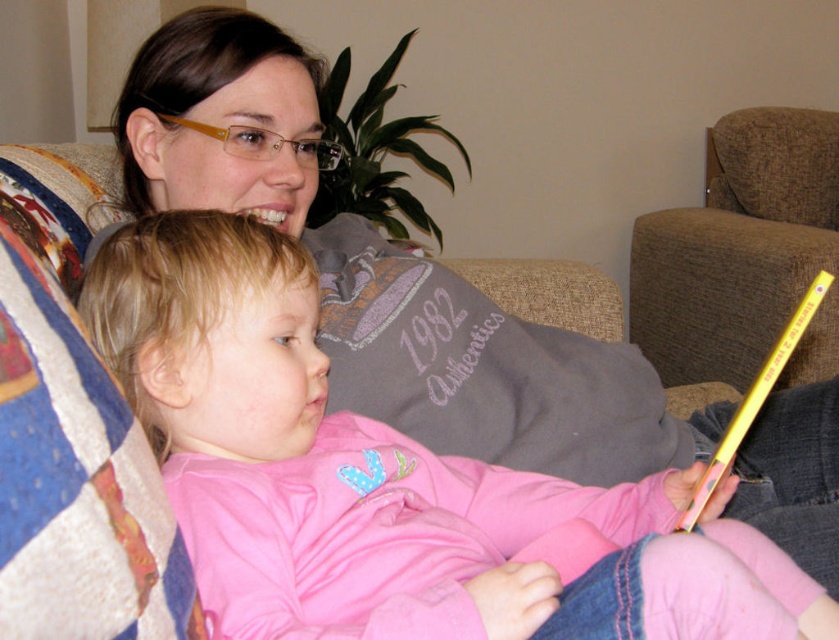
You are designing a layout for a small living room and need to place both the pink fleece sweater at center and the brown fabric armchair at upper right. Given their sizes, which object requires more space in the room?

The brown fabric armchair at upper right requires more space because the pink fleece sweater at center occupies less space than it.

You are a delivery person who needs to place a small package between the pink fleece sweater at center and the brown fabric armchair at upper right. The package is 1 foot in length. Can you fit the package in the space between them?

The pink fleece sweater at center is 5.24 feet away from the brown fabric armchair at upper right. Since the package is only 1 foot long, there is enough space to place it between them.

You are a delivery person standing 20 inches away from the couch. You need to place a small package on the pink fleece sweater at center without disturbing the people sitting there. Is the distance sufficient to do so?

The pink fleece sweater at center is 19.25 inches from the viewer. Since you are standing 20 inches away, you can reach it comfortably without needing to move closer, so the distance is sufficient to place the package without disturbing them.